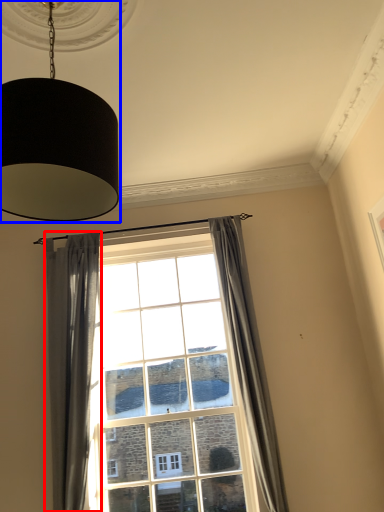
Question: Which object is closer to the camera taking this photo, curtain (highlighted by a red box) or lamp (highlighted by a blue box)?

Choices:
 (A) curtain
 (B) lamp

Answer: (B)